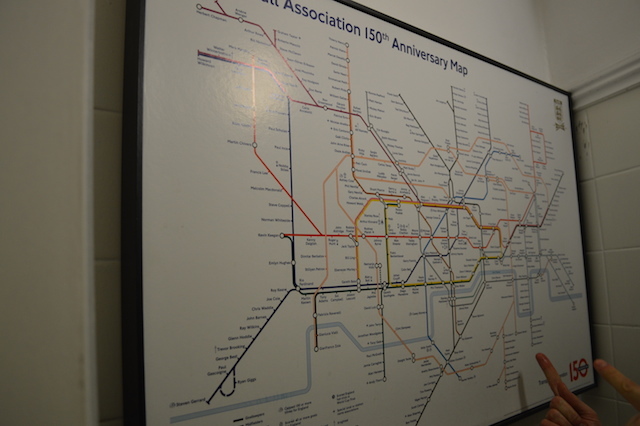
The height and width of the screenshot is (426, 640). Identify the location of smooth walls. (41, 220), (450, 19), (596, 28).